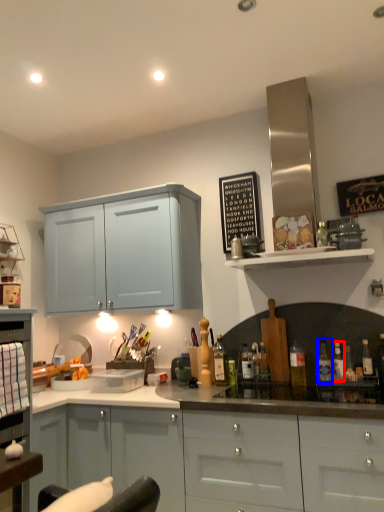
Question: Among these objects, which one is farthest to the camera, bottle (highlighted by a red box) or bottle (highlighted by a blue box)?

Choices:
 (A) bottle
 (B) bottle

Answer: (B)